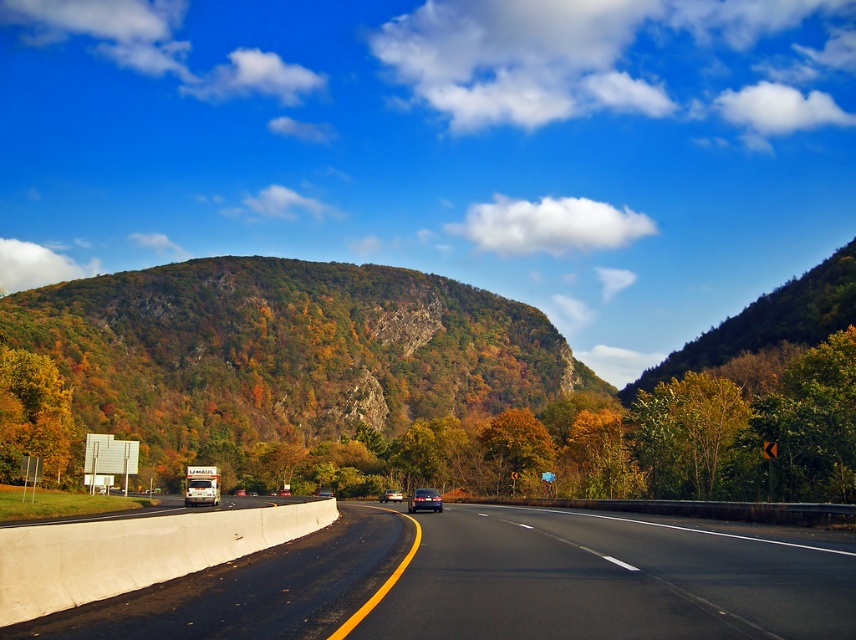
Question: Which object is positioned closest to the smooth asphalt road at center?

Choices:
 (A) metallic blue sedan at center
 (B) metallic silver sedan at center
 (C) golden textured tree at center

Answer: (A)

Question: Does green matte tree at left appear under metallic blue sedan at center?

Choices:
 (A) no
 (B) yes

Answer: (A)

Question: Can you confirm if smooth asphalt road at center is bigger than green matte tree at right?

Choices:
 (A) no
 (B) yes

Answer: (B)

Question: Which point appears farthest from the camera in this image?

Choices:
 (A) (12, 433)
 (B) (418, 504)
 (C) (536, 451)

Answer: (C)

Question: Among these points, which one is farthest from the camera?

Choices:
 (A) (266, 330)
 (B) (687, 538)

Answer: (A)

Question: Can you confirm if green matte tree at right is positioned above metallic blue sedan at center?

Choices:
 (A) no
 (B) yes

Answer: (B)